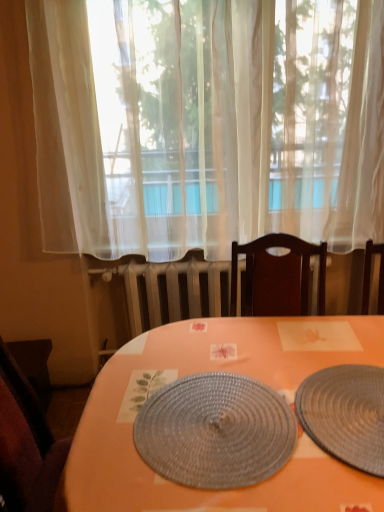
The image size is (384, 512). Identify the location of free spot above orange matte placemat at center (from a real-world perspective). (230, 397).